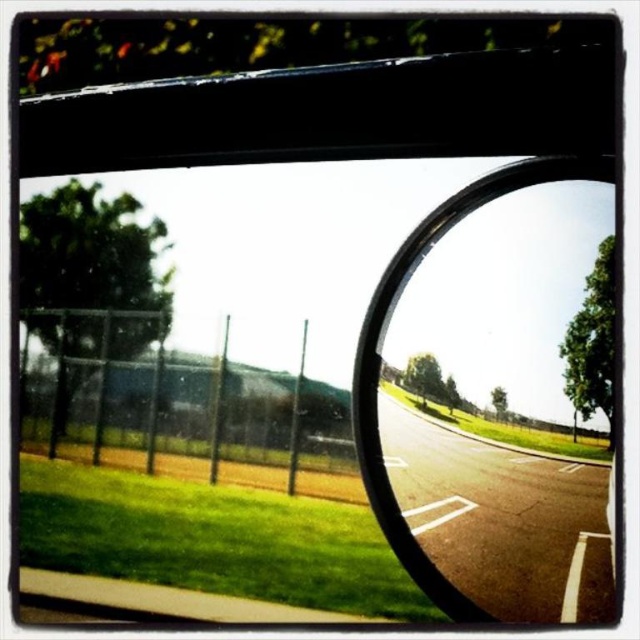
You are a passenger in a car and want to look at the road ahead through the transparent glass car window at center and black rubber car mirror at center. Which object should you look to the right of to see the road reflection?

You should look to the right of the transparent glass car window at center because it is positioned to the left of the black rubber car mirror at center, meaning the mirror is on the right side where the road reflection is shown.

You are a passenger in the car and want to know how far the point at coordinates point (486,348) is from the camera. Can you determine the distance?

The distance between point (486,348) and the camera is 22.31 inches.

You are a passenger in the car and want to see the road ahead clearly. Since you can only look through either the transparent glass car window at center or the black rubber car mirror at center, which one would allow you to see a larger portion of the road ahead?

The transparent glass car window at center is taller than the black rubber car mirror at center, so it would allow you to see a larger portion of the road ahead.